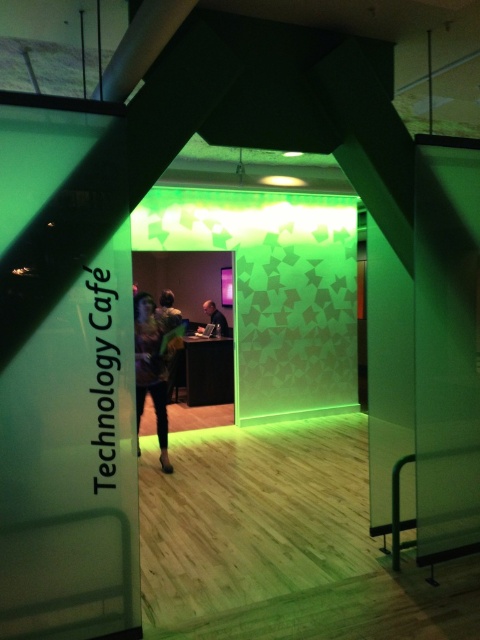
You are a customer at the Technology Cafe and you want to place your matte black laptop at center on a table that can only hold items smaller than the patterned fabric dress at center. Is this possible?

The patterned fabric dress at center is bigger than the matte black laptop at center, so yes, the matte black laptop at center can be placed on the table since it is smaller than the dress.

You are a customer entering the Technology Cafe and see both the patterned fabric dress at center and the matte black laptop at center. Which object would you need to step closer to in order to examine it more closely?

The patterned fabric dress at center is closer to the viewer than the matte black laptop at center, so you would need to step closer to the matte black laptop at center to examine it more closely.

You are a customer entering the Technology Cafe and see both the patterned fabric dress at center and the matte black laptop at center. Which object is taller?

The patterned fabric dress at center is much taller than the matte black laptop at center.